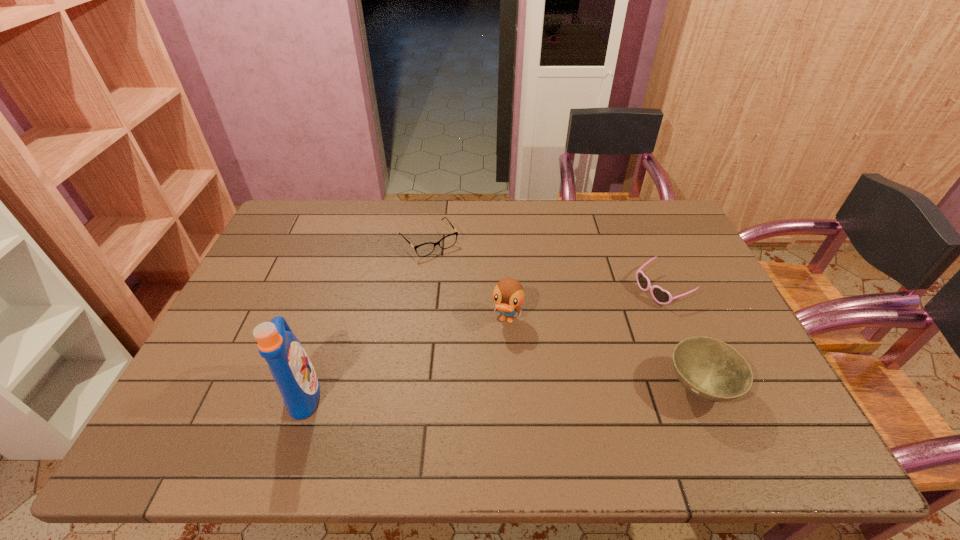
Where is `free location located on the front-facing side of the third object from right to left`? The height and width of the screenshot is (540, 960). free location located on the front-facing side of the third object from right to left is located at coordinates (487, 383).

You are a GUI agent. You are given a task and a screenshot of the screen. Output one action in this format:
    pyautogui.click(x=<x>, y=<y>)
    Task: Click on the vacant space located 0.090m on the front-facing side of the third object from right to left
    This screenshot has height=540, width=960.
    Given the screenshot: What is the action you would take?
    pyautogui.click(x=494, y=360)

Identify the location of free space located 0.200m on the front-facing side of the third object from right to left. (482, 397).

You are a GUI agent. You are given a task and a screenshot of the screen. Output one action in this format:
    pyautogui.click(x=<x>, y=<y>)
    Task: Click on the free space located 0.360m on the front-facing side of the sunglasses
    This screenshot has width=960, height=540.
    Given the screenshot: What is the action you would take?
    pyautogui.click(x=542, y=352)

Where is `free space located on the front-facing side of the sunglasses`? This screenshot has height=540, width=960. free space located on the front-facing side of the sunglasses is located at coordinates (572, 336).

Image resolution: width=960 pixels, height=540 pixels. I want to click on free location located 0.150m on the front-facing side of the sunglasses, so click(x=604, y=320).

The width and height of the screenshot is (960, 540). What are the coordinates of `free region located 0.340m on the front-facing side of the farthest object` in the screenshot? It's located at (499, 328).

This screenshot has height=540, width=960. I want to click on vacant space located 0.180m on the front-facing side of the farthest object, so click(x=469, y=292).

I want to click on free spot located on the front-facing side of the farthest object, so click(x=469, y=292).

Find the location of `object located at the far edge`. object located at the far edge is located at coordinates (448, 241).